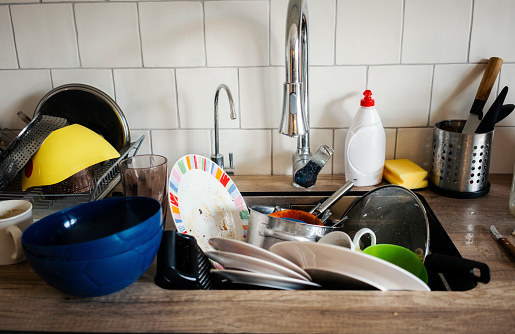
Where is `pots`? The height and width of the screenshot is (334, 515). pots is located at coordinates (187, 254), (48, 123), (115, 120), (305, 217), (287, 228), (394, 206).